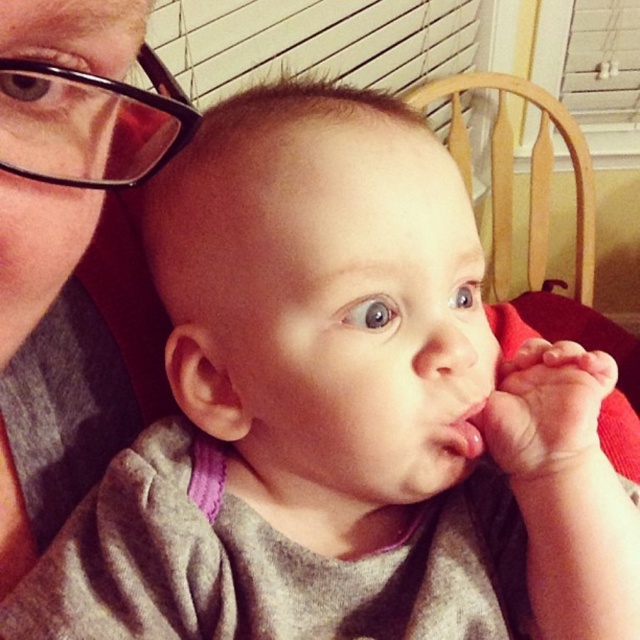
You are a photographer trying to capture a close up of the baby in the image. You need to ensure that both the matte gray shirt at upper left and the pink matte flesh at center are visible in the frame. Based on their positions, which object should you focus on first to ensure both are in the shot?

The matte gray shirt at upper left is located above the pink matte flesh at center, so focusing on the pink matte flesh at center first will ensure the matte gray shirt at upper left remains in the frame as well.

In the scene shown: You are a photographer standing at the camera position. You want to take a photo of the baby while ensuring the baby stays within the frame. The baby is currently at point (536, 252). If the camera has a focal length of 50mm and the sensor size is 24mm x 36mm, what is the minimum distance in feet you need to be from the baby to ensure it fits entirely within the frame?

The point (536, 252) and camera are 6.00 feet apart from each other. To ensure the baby fits within the frame with a 50mm lens and 24mm x 36mm sensor, the minimum distance should be at least 6.00 feet, as the current distance already accommodates the sensor dimensions for the baby to be in frame.